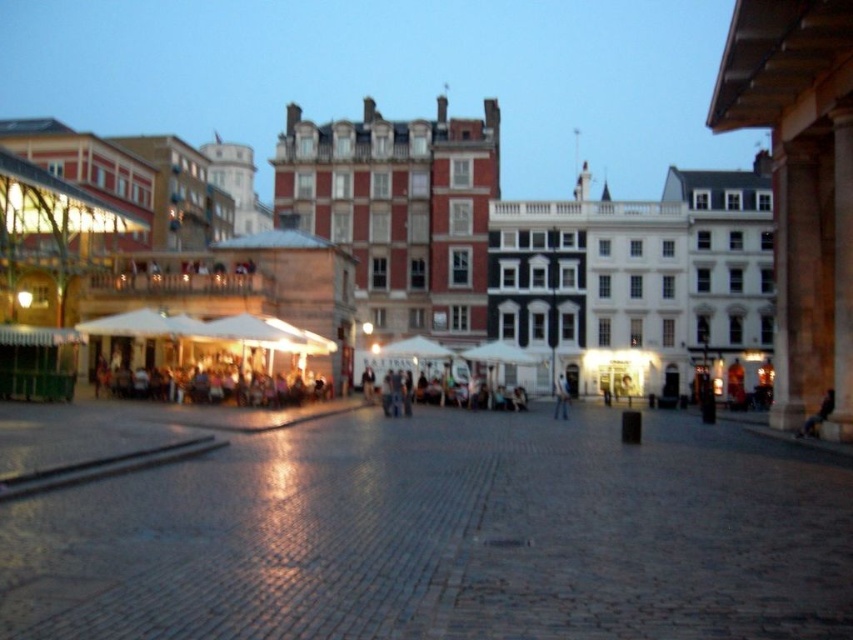
Question: From the image, what is the correct spatial relationship of white matte building at center in relation to light blue jeans at center?

Choices:
 (A) right
 (B) left

Answer: (B)

Question: Which of the following is the farthest from the observer?

Choices:
 (A) white matte building at center
 (B) light blue jeans at center

Answer: (B)

Question: Which point is closer to the camera taking this photo?

Choices:
 (A) (288, 150)
 (B) (556, 397)

Answer: (B)

Question: Which of the following is the farthest from the observer?

Choices:
 (A) (560, 417)
 (B) (602, 316)

Answer: (B)

Question: Does white matte building at center appear on the right side of light blue jeans at center?

Choices:
 (A) yes
 (B) no

Answer: (B)

Question: Is white matte building at center to the right of light blue jeans at center from the viewer's perspective?

Choices:
 (A) yes
 (B) no

Answer: (B)